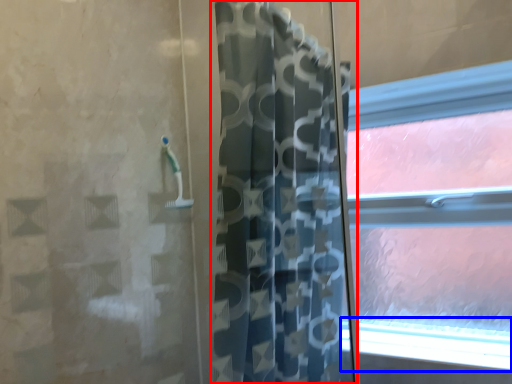
Question: Among these objects, which one is nearest to the camera, curtain (highlighted by a red box) or window sill (highlighted by a blue box)?

Choices:
 (A) curtain
 (B) window sill

Answer: (A)